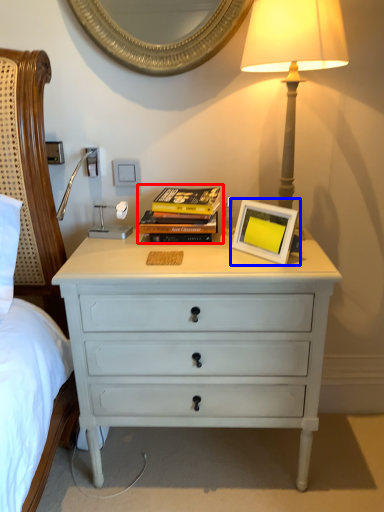
Question: Which object is further to the camera taking this photo, magazine (highlighted by a red box) or picture frame (highlighted by a blue box)?

Choices:
 (A) magazine
 (B) picture frame

Answer: (A)